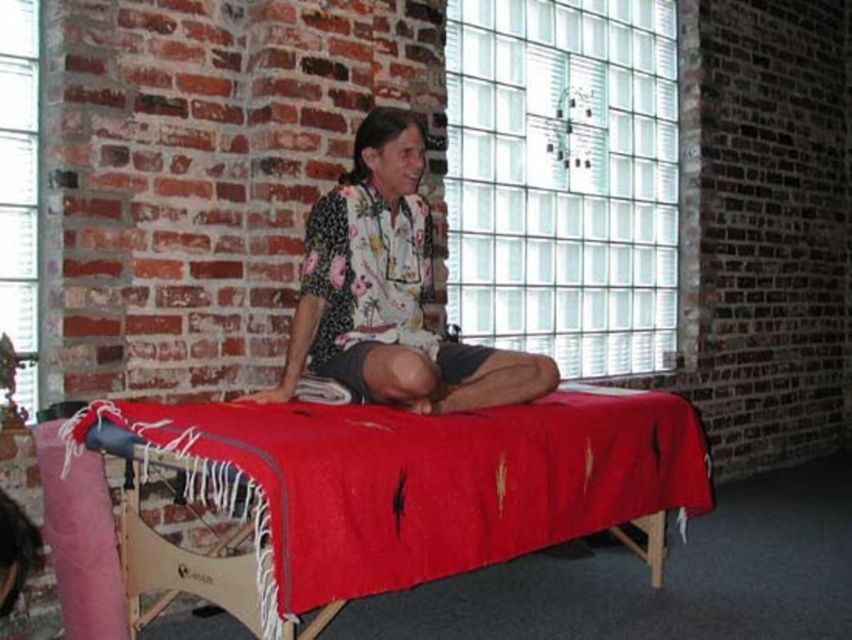
Looking at this image, between red woven blanket at center and floral fabric shirt at center, which one has more height?

With more height is floral fabric shirt at center.

Who is lower down, red woven blanket at center or floral fabric shirt at center?

red woven blanket at center is below.

Is point (193, 480) positioned behind point (341, 328)?

No.

This screenshot has width=852, height=640. Find the location of `red woven blanket at center`. red woven blanket at center is located at coordinates (417, 481).